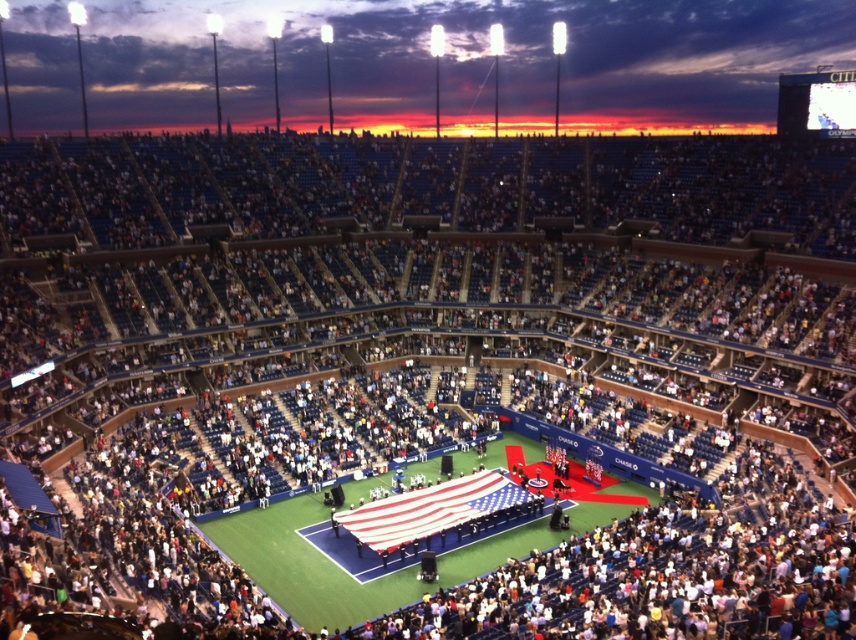
You are a photographer positioned at the back of the stadium. You want to take a photo of the green artificial turf at center and the american flag at center. Which object will appear taller in your photo?

The green artificial turf at center is taller than the american flag at center, so it will appear taller in the photo.

In the scene shown: You are a photographer positioned at the back of the stadium. You want to capture a photo of the american flag at center without the green artificial turf at center appearing in the foreground. Is this possible given their positions?

The green artificial turf at center is below the american flag at center, so if you position yourself at the back of the stadium and aim your camera upwards towards the american flag at center, the green artificial turf at center would be behind the flag and not in the foreground.

In the scene shown: You are a photographer positioned at the center of the stadium. You want to take a photo that includes both the point at coordinates point (221, 525) and point (495, 481). Which point should you focus on first to ensure both are in sharp focus?

You should focus on point (221, 525) first because it is closer to you than point (495, 481). This ensures that both points will be within the depth of field when you adjust the camera settings.